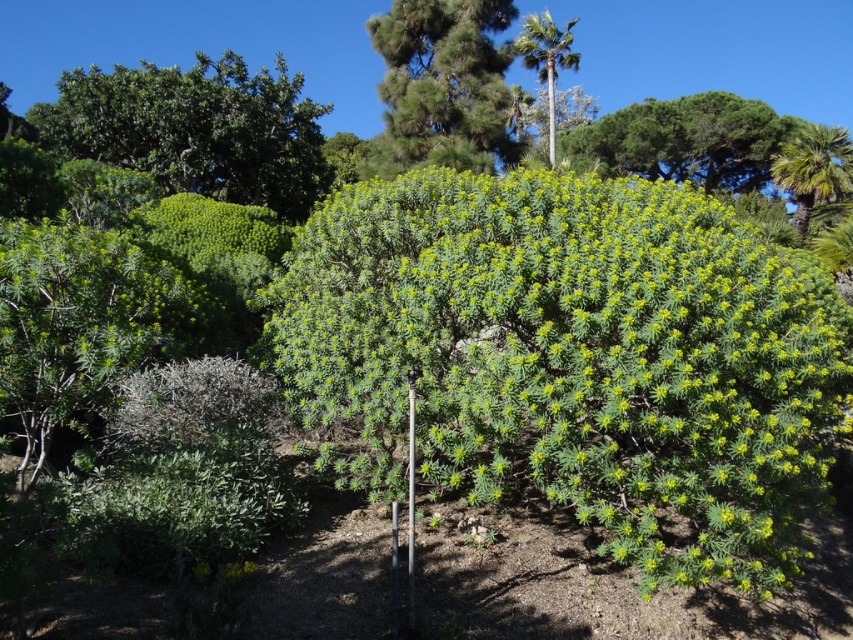
Question: Which of these objects is positioned closest to the green leafy tree at upper center?

Choices:
 (A) green leafy bush at center
 (B) green leafy palm at upper center
 (C) green leafy palm at right

Answer: (B)

Question: Considering the relative positions of green leafy bush at upper center and green leafy palm at upper center in the image provided, where is green leafy bush at upper center located with respect to green leafy palm at upper center?

Choices:
 (A) left
 (B) right

Answer: (B)

Question: Is green leafy bush at center wider than green leafy palm at upper center?

Choices:
 (A) no
 (B) yes

Answer: (B)

Question: Does green leafy palm at right have a larger size compared to green leafy palm at upper center?

Choices:
 (A) no
 (B) yes

Answer: (A)

Question: Which of the following is the farthest from the observer?

Choices:
 (A) (767, 172)
 (B) (788, 528)

Answer: (A)

Question: Among these points, which one is nearest to the camera?

Choices:
 (A) (614, 541)
 (B) (161, 97)
 (C) (598, 125)
 (D) (537, 54)

Answer: (A)